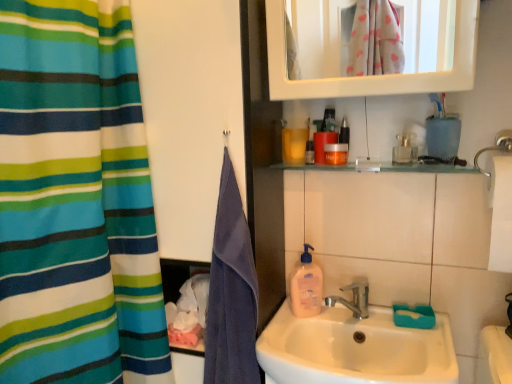
Where is `free space to the right of orange matte jar at upper center, the second mouthwash when ordered from left to right`? This screenshot has width=512, height=384. free space to the right of orange matte jar at upper center, the second mouthwash when ordered from left to right is located at coordinates (372, 162).